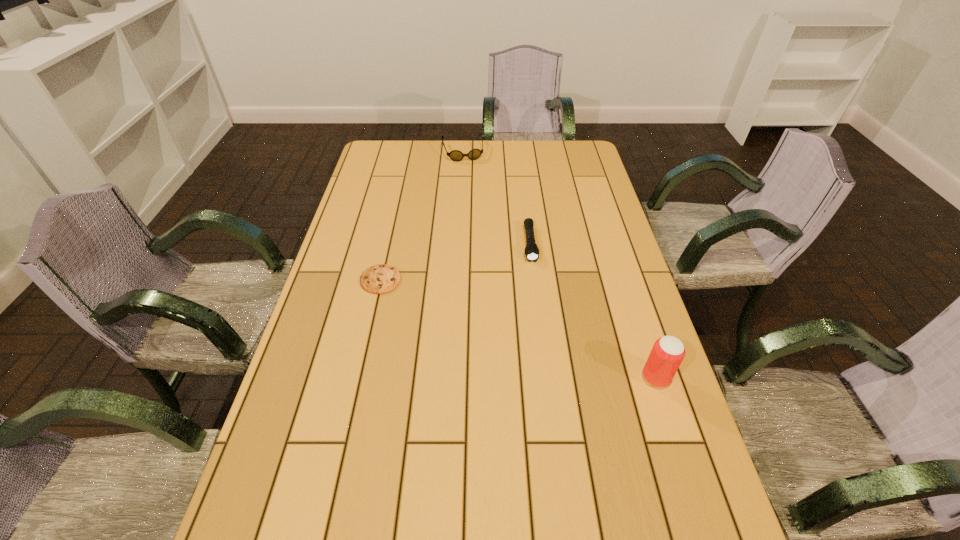
Locate an element on the screen. vacant area at the near edge is located at coordinates (611, 507).

Find the location of a particular element. vacant space at the left edge of the desktop is located at coordinates (304, 431).

I want to click on vacant space at the right edge, so click(x=589, y=324).

Find the location of a particular element. free spot at the far left corner of the desktop is located at coordinates (406, 153).

Where is `free space at the near right corner`? Image resolution: width=960 pixels, height=540 pixels. free space at the near right corner is located at coordinates (679, 528).

Image resolution: width=960 pixels, height=540 pixels. In order to click on free area in between the rightmost object and the leftmost object in this screenshot , I will do point(518,329).

Identify the location of unoccupied position between the tallest object and the second nearest object. Image resolution: width=960 pixels, height=540 pixels. (518, 329).

Locate an element on the screen. The width and height of the screenshot is (960, 540). unoccupied position between the beer can and the third object from left to right is located at coordinates (593, 310).

Image resolution: width=960 pixels, height=540 pixels. In order to click on free space between the second object from left to right and the leftmost object in this screenshot , I will do `click(421, 215)`.

Identify the location of free spot between the second shortest object and the third farthest object. (455, 262).